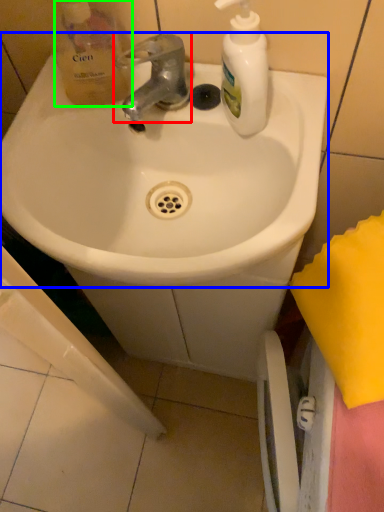
Question: Which is nearer to the tap (highlighted by a red box)? sink (highlighted by a blue box) or product (highlighted by a green box).

Choices:
 (A) sink
 (B) product

Answer: (B)